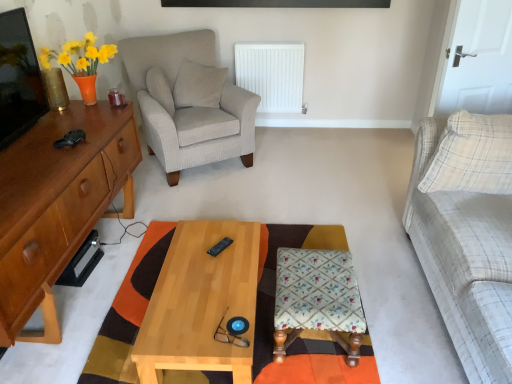
Question: From a real-world perspective, is checkered fabric pillow at upper center, the first pillow viewed from the back, above or below white plastic radiator at center?

Choices:
 (A) below
 (B) above

Answer: (B)

Question: Is checkered fabric pillow at upper center, which is the second pillow from left to right, wider or thinner than white plastic radiator at center?

Choices:
 (A) wide
 (B) thin

Answer: (A)

Question: Based on their relative distances, which object is nearer to the light gray textured armchair at center?

Choices:
 (A) gold metallic vase at left
 (B) matte wood dresser at left
 (C) white plastic radiator at center
 (D) checkered fabric pillow at upper center, which is the second pillow from left to right
 (E) wooden table at center

Answer: (D)

Question: Estimate the real-world distances between objects in this image. Which object is closer to the white fabric pillow at upper center, which is counted as the 3th pillow, starting from the right?

Choices:
 (A) yellow matte vase at upper left
 (B) light wood/texture coffee table at center
 (C) plaid fabric couch at right
 (D) wooden table at center
 (E) light gray textured armchair at center

Answer: (E)